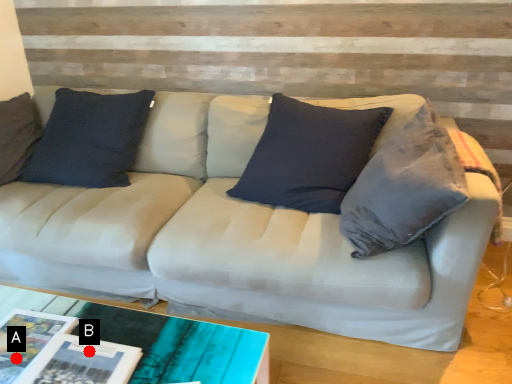
Question: Two points are circled on the image, labeled by A and B beside each circle. Among these points, which one is farthest from the camera?

Choices:
 (A) A is further
 (B) B is further

Answer: (A)